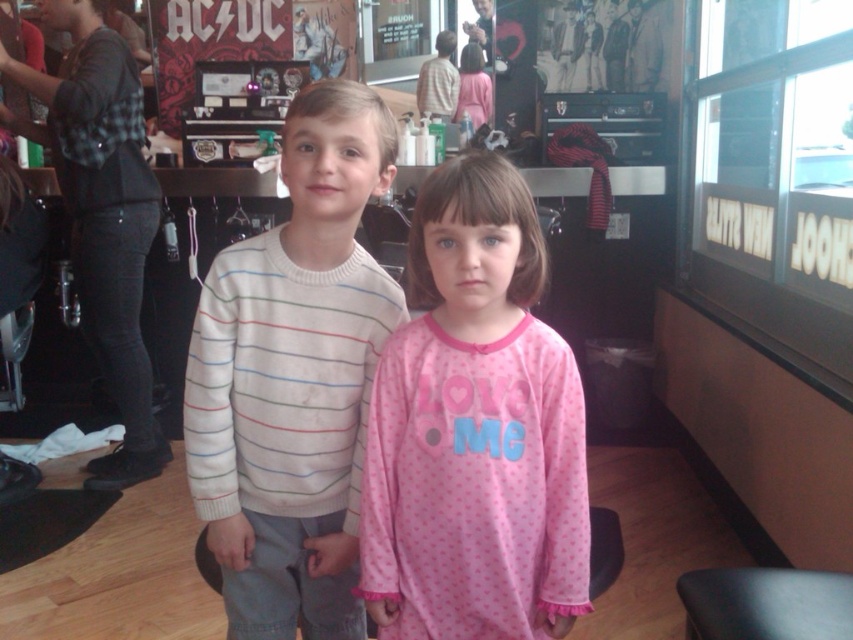
Question: Can you confirm if pink fleece pajamas at center is positioned to the right of black flannel shirt at left?

Choices:
 (A) yes
 (B) no

Answer: (A)

Question: Among these points, which one is farthest from the camera?

Choices:
 (A) (473, 476)
 (B) (292, 186)
 (C) (114, 260)

Answer: (C)

Question: Is pink fleece pajamas at center to the right of white striped sweater at center from the viewer's perspective?

Choices:
 (A) no
 (B) yes

Answer: (B)

Question: Among these points, which one is farthest from the camera?

Choices:
 (A) (119, 476)
 (B) (402, 403)

Answer: (A)

Question: Does pink fleece pajamas at center appear over white striped sweater at center?

Choices:
 (A) no
 (B) yes

Answer: (B)

Question: Which of the following is the farthest from the observer?

Choices:
 (A) white striped sweater at center
 (B) pink fleece pajamas at center
 (C) black flannel shirt at left

Answer: (C)